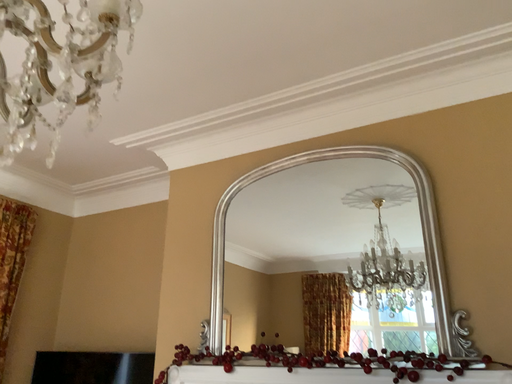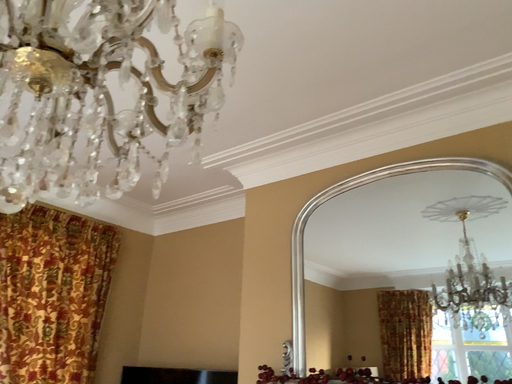
Question: How did the camera likely rotate when shooting the video?

Choices:
 (A) rotated right
 (B) rotated left

Answer: (B)